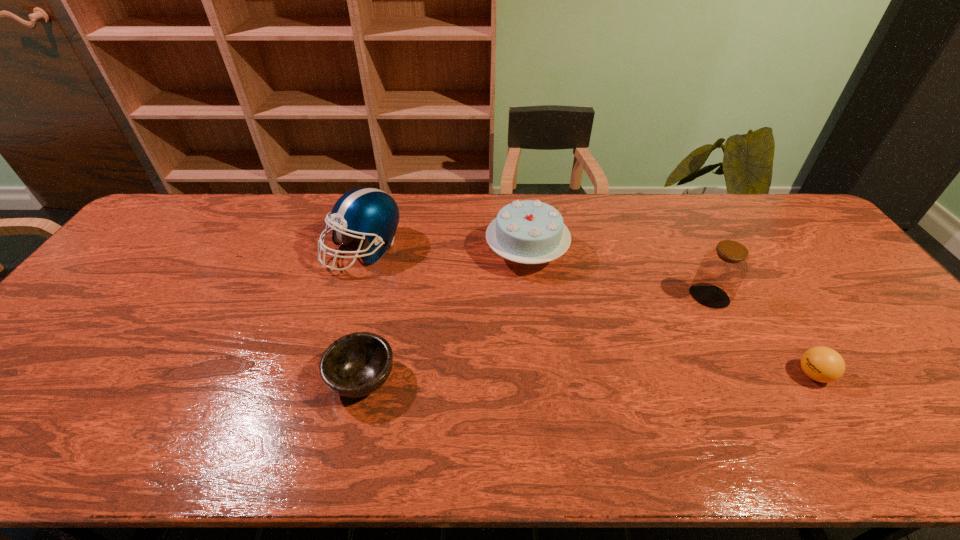
Locate an element on the screen. football helmet is located at coordinates (370, 213).

Locate an element on the screen. This screenshot has height=540, width=960. the third nearest object is located at coordinates (722, 270).

Identify the location of jar. This screenshot has height=540, width=960. (722, 270).

Identify the location of birthday cake. The height and width of the screenshot is (540, 960). (531, 232).

The width and height of the screenshot is (960, 540). Identify the location of ping-pong ball. (822, 364).

Identify the location of bowl. (357, 364).

At what (x,y) coordinates should I click in order to perform the action: click on free space located at the front of the football helmet with the faceguard. Please return your answer as a coordinate pair (x, y). This screenshot has height=540, width=960. Looking at the image, I should click on (338, 339).

In order to click on vacant space located 0.290m on the left of the third nearest object in this screenshot , I will do `click(586, 296)`.

Where is `vacant space situated on the back of the birthday cake`? The image size is (960, 540). vacant space situated on the back of the birthday cake is located at coordinates (522, 218).

Find the location of a particular element. This screenshot has width=960, height=540. free point located on the side with brand of the ping-pong ball is located at coordinates (x=636, y=375).